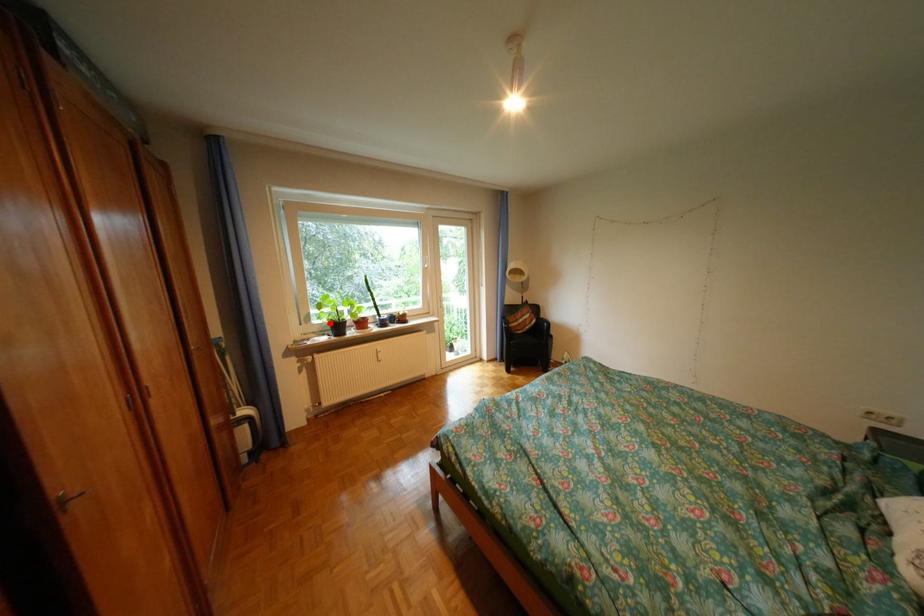
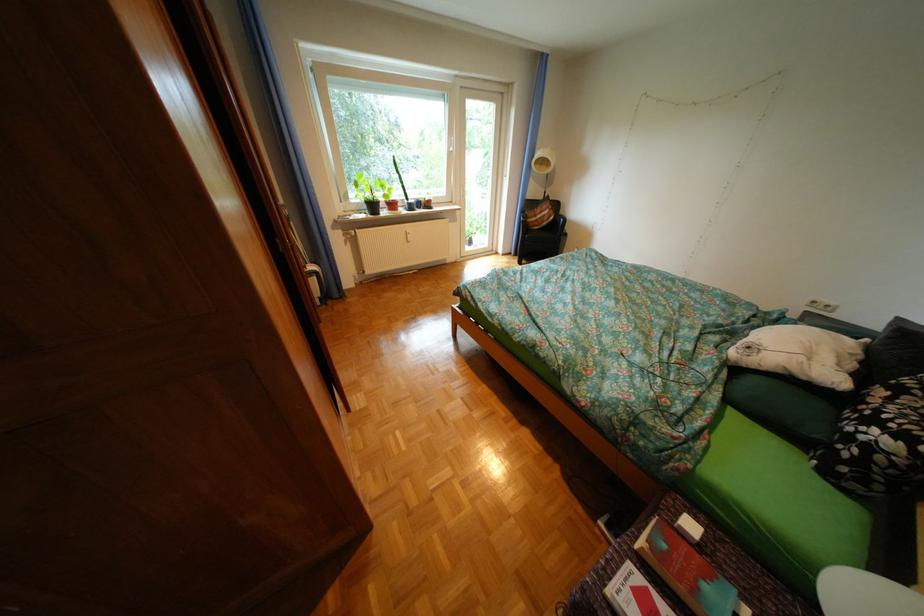
Question: I am providing you with two images of the same scene from different viewpoints. Given a red point in image1, look at the same physical point in image2. Is it:

Choices:
 (A) Closer to the viewpoint
 (B) Farther from the viewpoint

Answer: (A)